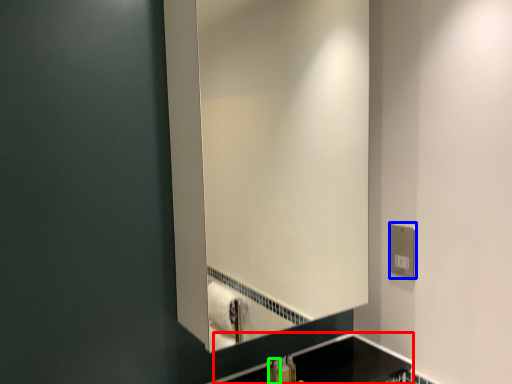
Question: Based on their relative distances, which object is nearer to counter top (highlighted by a red box)? Choose from electric outlet (highlighted by a blue box) and toiletry (highlighted by a green box).

Choices:
 (A) electric outlet
 (B) toiletry

Answer: (B)